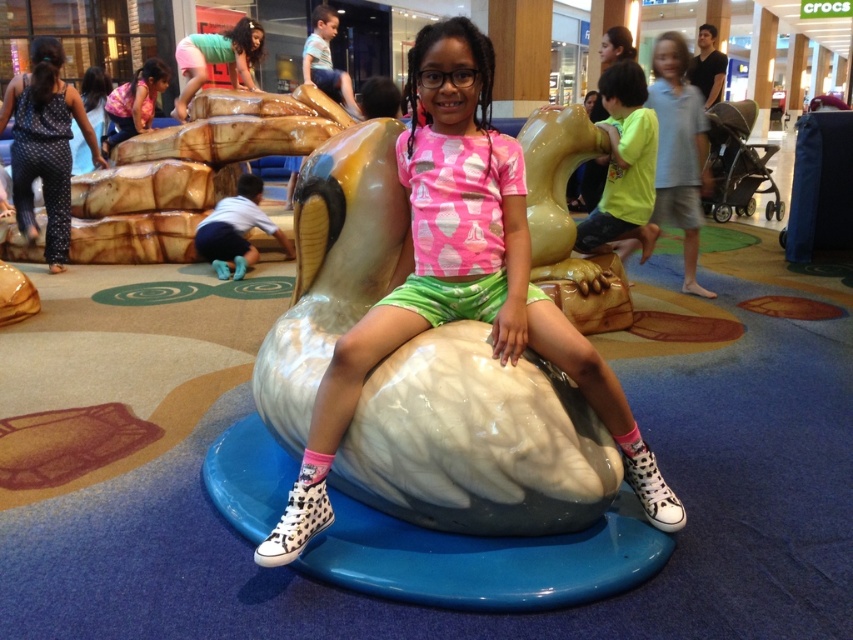
You are a photographer trying to capture the white glossy dolphin at center and the matte pink shirt at upper center in the same frame. Based on their positions, which object is located to the right of the other?

The white glossy dolphin at center is positioned on the right side of the matte pink shirt at upper center.

You are standing at the entrance of the Crocs store and want to find the white glossy dolphin at center. According to the coordinates given, where should you look relative to the entrance?

The white glossy dolphin at center is located at coordinates 0.441 on the x axis and 0.538 on the y axis, so you should look towards the center area of the image, slightly to the right and above the entrance.

You are a photographer standing in the shopping mall near the Crocs store. You want to take a photo of the white glossy dolphin at center and the matte pink shirt at upper center. Can you see both objects in the same frame without moving your camera? Explain why or why not.

Yes, the white glossy dolphin at center is in front of the matte pink shirt at upper center, so both objects are visible in the same frame without needing to move the camera.